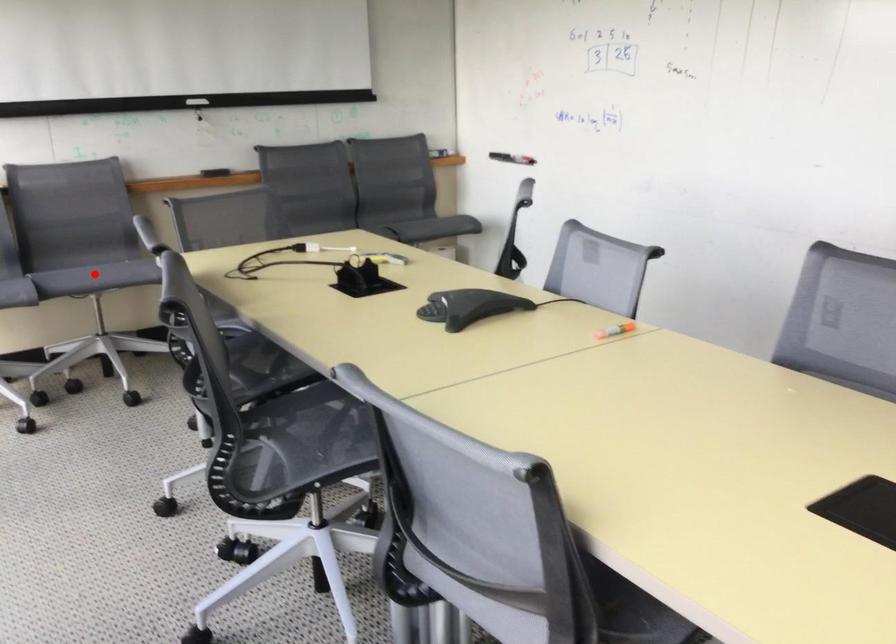
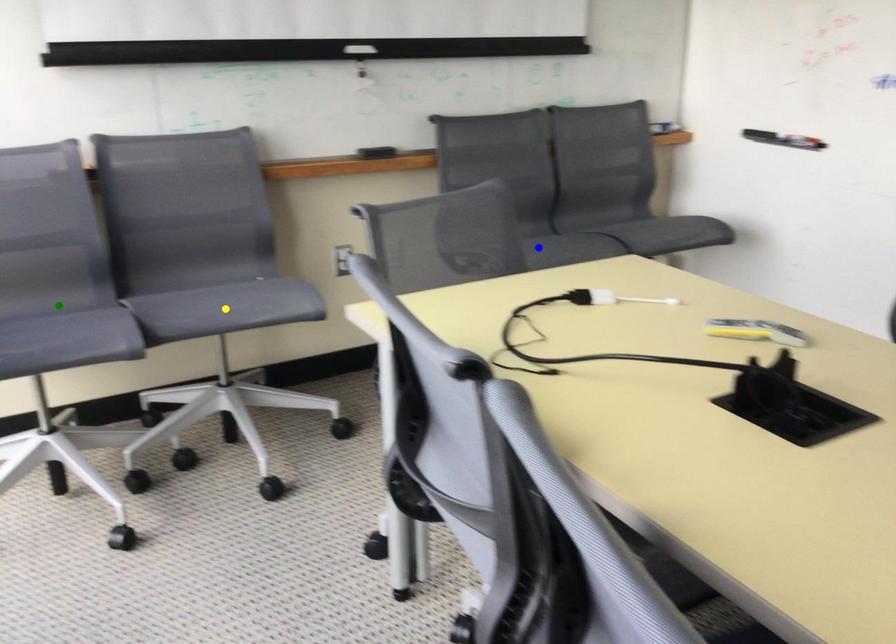
Question: I am providing you with two images of the same scene from different viewpoints. A red point is marked on the first image. You are given multiple points on the second image. Which spot in image 2 lines up with the point in image 1?

Choices:
 (A) blue point
 (B) green point
 (C) yellow point

Answer: (C)